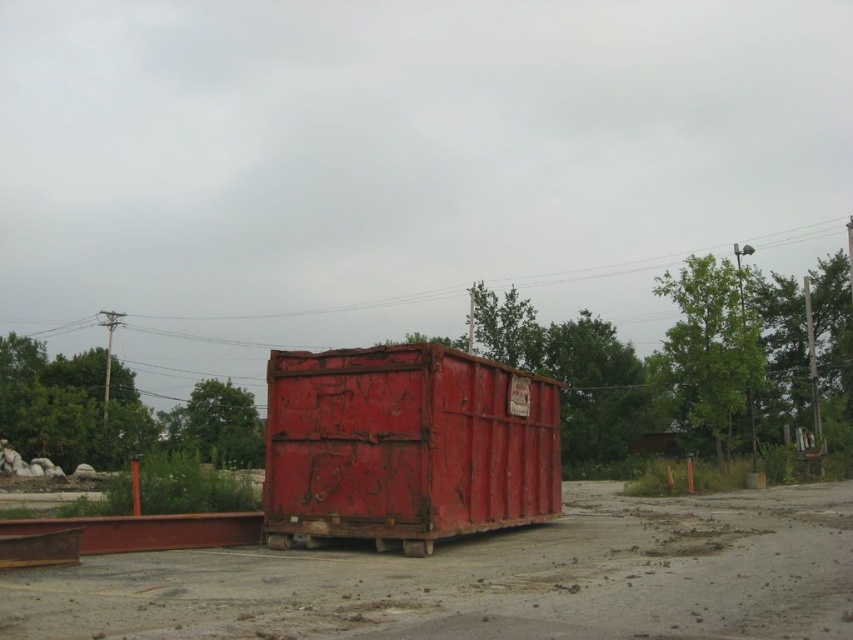
Is point (814, 492) closer to camera compared to point (306, 364)?

That is False.

Between dull concrete dirt track at center and rusty metal shipping container at center, which one appears on the right side from the viewer's perspective?

Positioned to the right is dull concrete dirt track at center.

Does point (297, 579) come closer to viewer compared to point (410, 525)?

Yes, point (297, 579) is in front of point (410, 525).

The height and width of the screenshot is (640, 853). What are the coordinates of `dull concrete dirt track at center` in the screenshot? It's located at (486, 579).